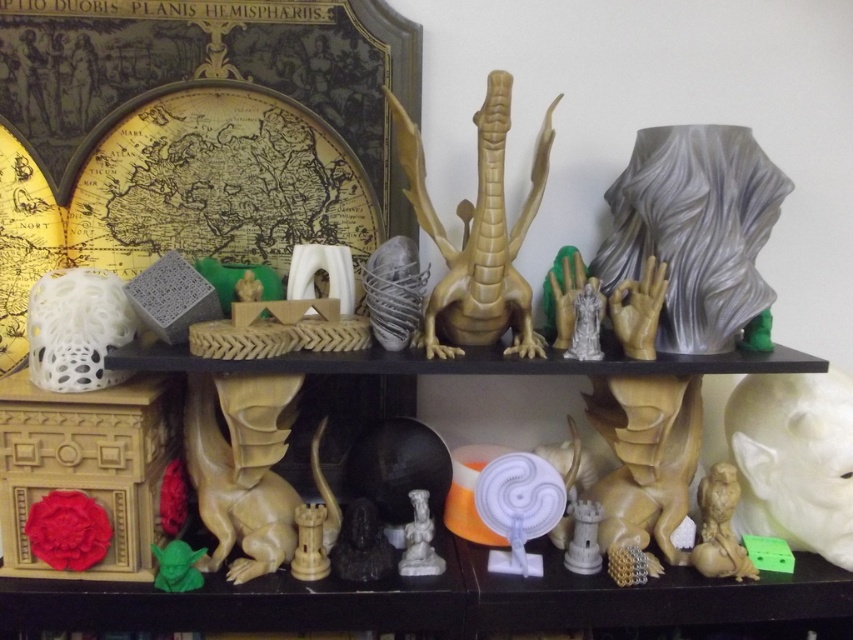
You are an art curator arranging the 3D models on the shelves. You need to move the matte brown owl at lower right to the left side of the matte white tower at center. Is this possible without removing the tower from its current position?

The matte brown owl at lower right is positioned over the matte white tower at center, so moving it to the left side would require removing the tower first.

In the scene shown: You are an art curator examining the 3D models on the shelves. You need to place a new label between the white matte bird at lower right and the matte gold dragon at center. Can you position it so that it is closer to the dragon than the bird?

The white matte bird at lower right is further to the viewer than the matte gold dragon at center. Therefore, placing the label closer to the dragon would require positioning it behind the bird, but since the bird is already closer to the viewer, the label cannot be placed between them in a way that is closer to the dragon without being behind the bird.

You are an art curator planning to display a new sculpture that is 1.2 meters tall. You want to place it on the shelf where the matte brown owl at lower right and the matte white tower at center are located. Based on their sizes, can you determine if the new sculpture will fit on the same shelf without exceeding the shelf height?

The matte brown owl at lower right is bigger than the matte white tower at center. Since the new sculpture is 1.2 meters tall, and the owl is already larger than the tower, it is possible that the shelf can accommodate the new sculpture. However, without knowing the exact height of the owl or the shelf dimensions, we cannot definitively confirm if the sculpture will fit.